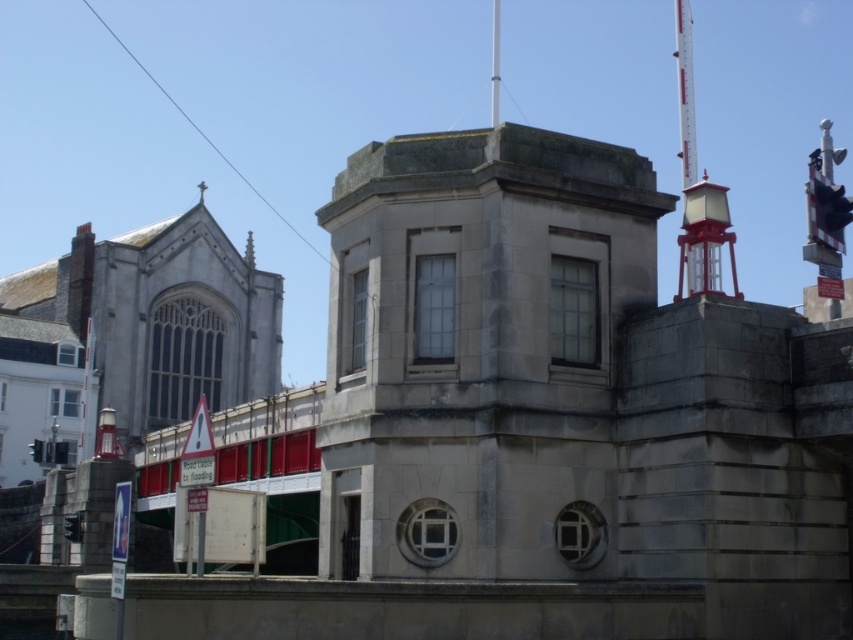
Question: Which point is farther to the camera?

Choices:
 (A) red painted metal mast at upper right
 (B) gray stone tower at center

Answer: (A)

Question: Is gray stone tower at center to the left of red painted metal mast at upper right from the viewer's perspective?

Choices:
 (A) yes
 (B) no

Answer: (A)

Question: Which point is farther from the camera taking this photo?

Choices:
 (A) (491, 65)
 (B) (569, 451)
 (C) (682, 10)

Answer: (C)

Question: Among these objects, which one is nearest to the camera?

Choices:
 (A) metallic pole at upper center
 (B) gray stone tower at center
 (C) red painted metal mast at upper right

Answer: (B)

Question: Does gray stone tower at center appear over red painted metal mast at upper right?

Choices:
 (A) no
 (B) yes

Answer: (A)

Question: Is red painted metal mast at upper right above metallic pole at upper center?

Choices:
 (A) yes
 (B) no

Answer: (B)